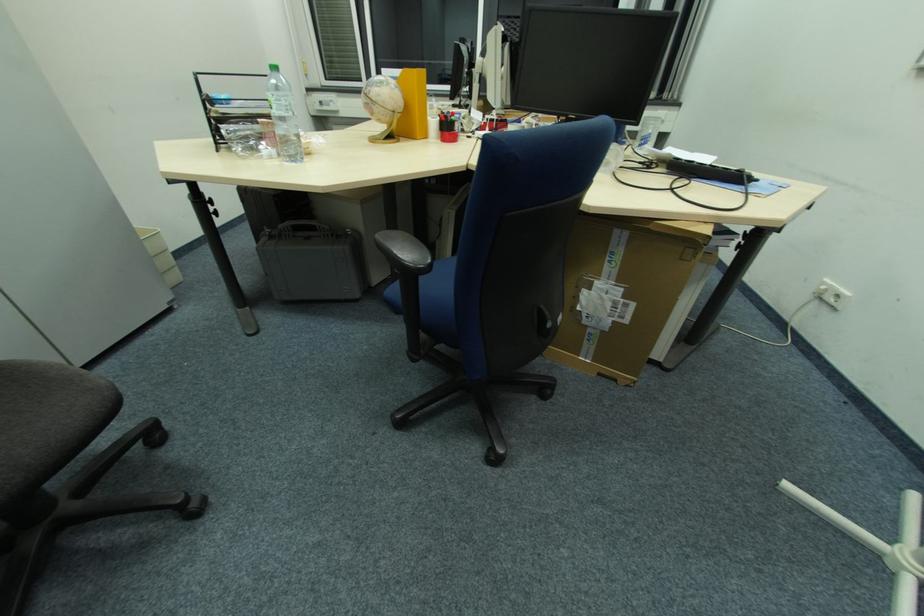
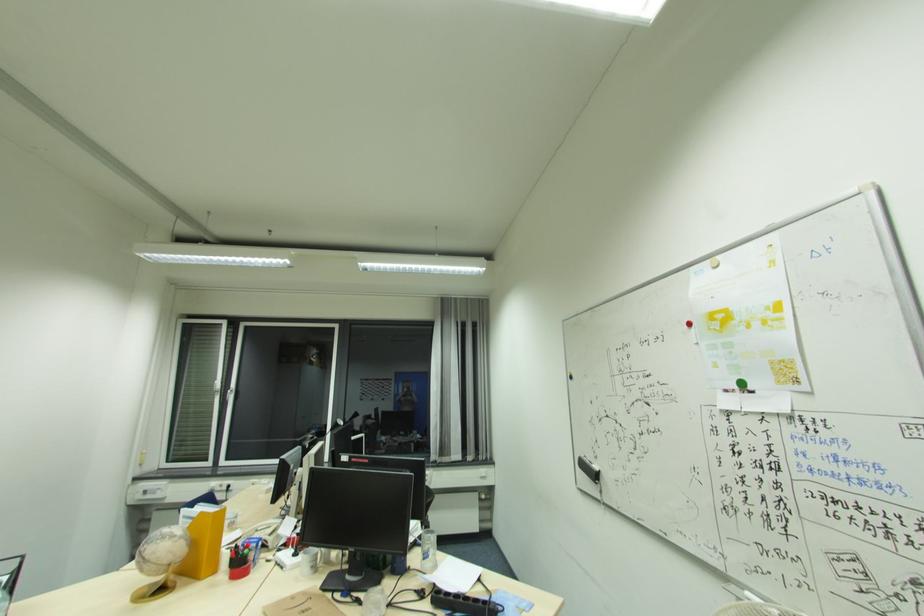
Find the pixel in the second image that matches pixel 642 147 in the first image.

(428, 560)